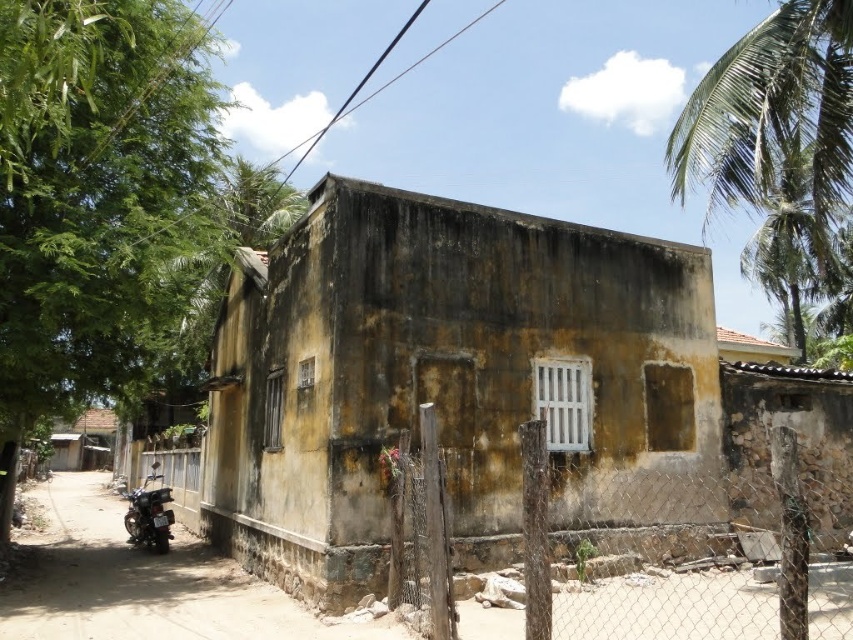
Does wooden post at center have a larger size compared to smooth concrete alley at lower left?

Actually, wooden post at center might be smaller than smooth concrete alley at lower left.

Who is lower down, wooden post at center or smooth concrete alley at lower left?

smooth concrete alley at lower left is lower down.

Is point (602, 568) closer to camera compared to point (234, 625)?

No, (602, 568) is behind (234, 625).

What are the coordinates of `wooden post at center` in the screenshot? It's located at (631, 552).

Which is above, wooden post at center or shiny black motorbike at lower left?

wooden post at center is above.

Does wooden post at center appear over shiny black motorbike at lower left?

Yes.

The image size is (853, 640). Describe the element at coordinates (631, 552) in the screenshot. I see `wooden post at center` at that location.

Image resolution: width=853 pixels, height=640 pixels. What are the coordinates of `wooden post at center` in the screenshot? It's located at (631, 552).

Is green leafy tree at left wider than shiny black motorbike at lower left?

No, green leafy tree at left is not wider than shiny black motorbike at lower left.

Between green leafy tree at left and shiny black motorbike at lower left, which one appears on the right side from the viewer's perspective?

green leafy tree at left

This screenshot has height=640, width=853. What do you see at coordinates (93, 198) in the screenshot? I see `green leafy tree at left` at bounding box center [93, 198].

Locate an element on the screen. This screenshot has width=853, height=640. green leafy tree at left is located at coordinates (93, 198).